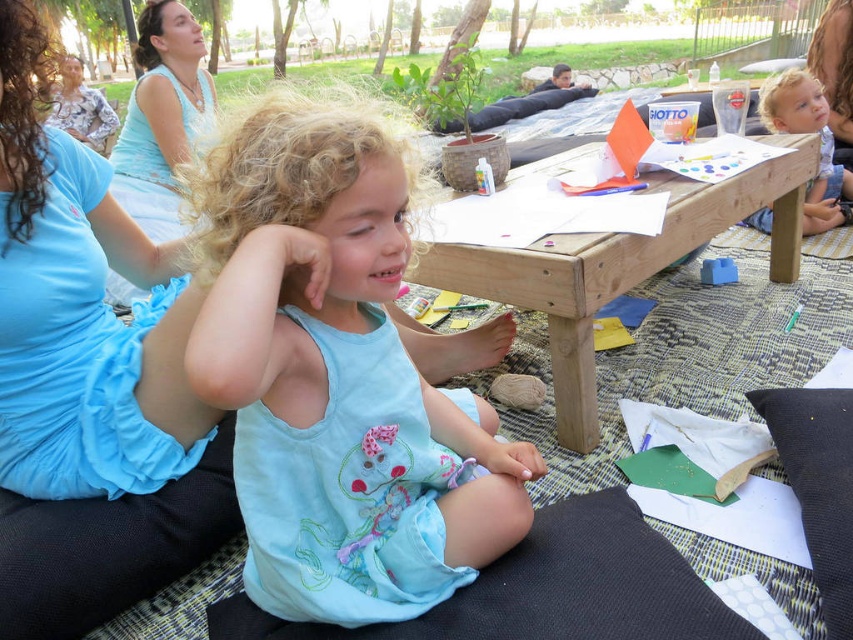
Question: Estimate the real-world distances between objects in this image. Which object is farther from the matte blue tank top at upper left?

Choices:
 (A) light blue fabric dress at center
 (B) blonde hair at upper right

Answer: (B)

Question: Can you confirm if matte blue tank top at upper left is positioned to the right of floral fabric dress at upper left?

Choices:
 (A) no
 (B) yes

Answer: (B)

Question: Which point is closer to the camera?

Choices:
 (A) (761, 108)
 (B) (705, 237)

Answer: (B)

Question: Which object appears farthest from the camera in this image?

Choices:
 (A) blonde hair at upper right
 (B) light blue fabric dress at center

Answer: (A)

Question: Can you confirm if wooden picnic table at center is bigger than blonde hair at upper right?

Choices:
 (A) yes
 (B) no

Answer: (A)

Question: Can you confirm if blonde hair at upper right is positioned above floral fabric dress at upper left?

Choices:
 (A) yes
 (B) no

Answer: (B)